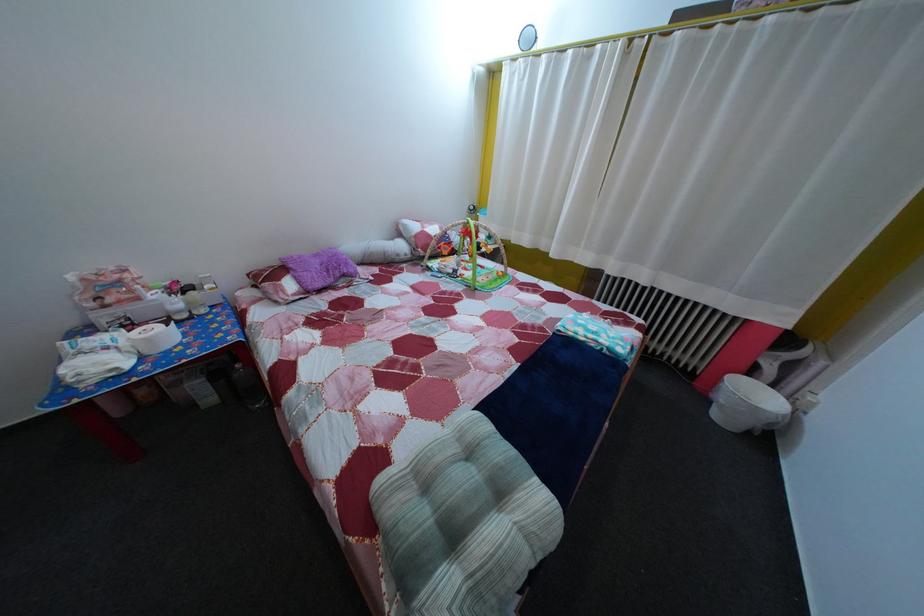
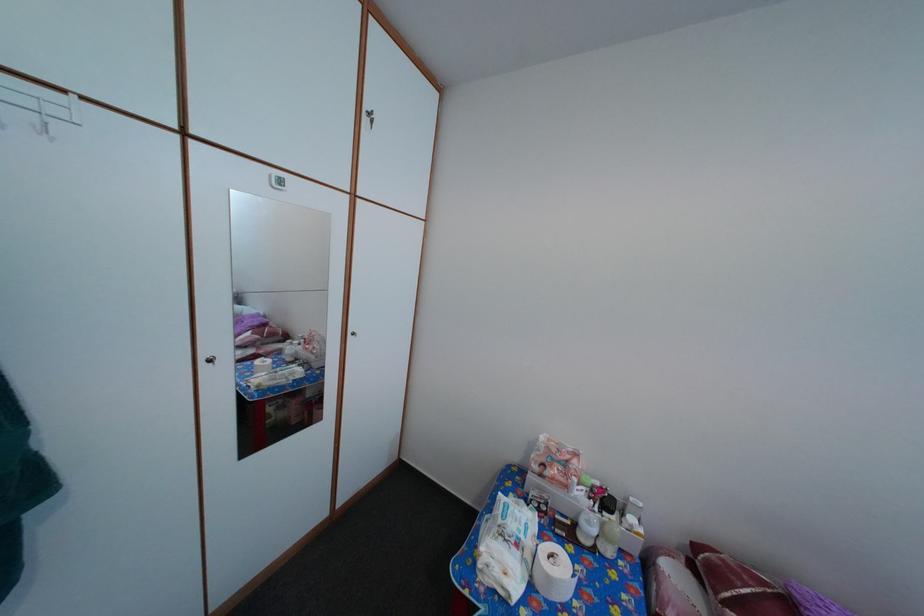
Where in the second image is the point corresponding to the point at 79,395 from the first image?

(484, 572)